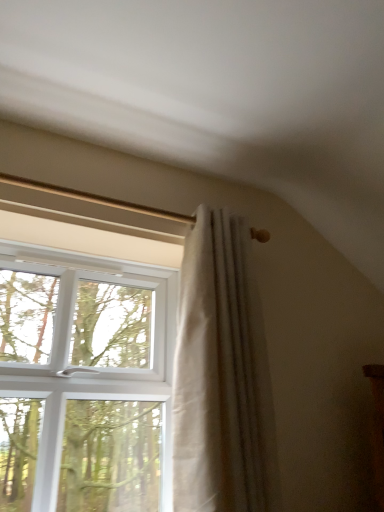
This screenshot has height=512, width=384. Find the location of `white textured curtain at center`. white textured curtain at center is located at coordinates (221, 377).

What do you see at coordinates (221, 377) in the screenshot? I see `white textured curtain at center` at bounding box center [221, 377].

The width and height of the screenshot is (384, 512). Describe the element at coordinates (84, 382) in the screenshot. I see `white plastic window at upper left` at that location.

The image size is (384, 512). Find the location of `white plastic window at upper left`. white plastic window at upper left is located at coordinates (84, 382).

Image resolution: width=384 pixels, height=512 pixels. I want to click on white textured curtain at center, so click(221, 377).

Which is more to the right, white textured curtain at center or white plastic window at upper left?

white textured curtain at center.

Who is more distant, white textured curtain at center or white plastic window at upper left?

white textured curtain at center is further away from the camera.

Considering the positions of points (175, 410) and (17, 409), is point (175, 410) farther from camera compared to point (17, 409)?

No, it is not.

From the image's perspective, which one is positioned lower, white textured curtain at center or white plastic window at upper left?

white plastic window at upper left.

In the scene shown: From a real-world perspective, is white textured curtain at center physically below white plastic window at upper left?

No, from a real-world perspective, white textured curtain at center is not beneath white plastic window at upper left.

Looking at their sizes, would you say white textured curtain at center is wider or thinner than white plastic window at upper left?

In the image, white textured curtain at center appears to be more narrow than white plastic window at upper left.

Who is taller, white textured curtain at center or white plastic window at upper left?

Standing taller between the two is white textured curtain at center.

Considering the relative sizes of white textured curtain at center and white plastic window at upper left in the image provided, is white textured curtain at center bigger than white plastic window at upper left?

No, white textured curtain at center is not bigger than white plastic window at upper left.

Would you say white textured curtain at center contains white plastic window at upper left?

That's incorrect, white plastic window at upper left is not inside white textured curtain at center.

Would you consider white textured curtain at center to be distant from white plastic window at upper left?

They are positioned close to each other.

Could you tell me if white textured curtain at center is turned towards white plastic window at upper left?

No, white textured curtain at center is not facing towards white plastic window at upper left.

How different are the orientations of white textured curtain at center and white plastic window at upper left in degrees?

The facing directions of white textured curtain at center and white plastic window at upper left are 0.0031 degrees apart.

How far apart are white textured curtain at center and white plastic window at upper left?

white textured curtain at center is 17.33 inches away from white plastic window at upper left.

The width and height of the screenshot is (384, 512). I want to click on window in front of the white textured curtain at center, so click(x=84, y=382).

Is white plastic window at upper left to the left of white textured curtain at center from the viewer's perspective?

Yes.

Between white plastic window at upper left and white textured curtain at center, which one is positioned behind?

white textured curtain at center is more distant.

Which is in front, point (91, 454) or point (245, 346)?

The point (245, 346) is more forward.

From the image's perspective, between white plastic window at upper left and white textured curtain at center, which one is located above?

From the image's view, white textured curtain at center is above.

From a real-world perspective, does white plastic window at upper left stand above white textured curtain at center?

Actually, white plastic window at upper left is physically below white textured curtain at center in the real world.

Considering the sizes of objects white plastic window at upper left and white textured curtain at center in the image provided, who is thinner, white plastic window at upper left or white textured curtain at center?

white textured curtain at center is thinner.

Considering the sizes of objects white plastic window at upper left and white textured curtain at center in the image provided, who is taller, white plastic window at upper left or white textured curtain at center?

With more height is white textured curtain at center.

Which of these two, white plastic window at upper left or white textured curtain at center, is smaller?

Smaller between the two is white textured curtain at center.

Would you say white plastic window at upper left is inside or outside white textured curtain at center?

white plastic window at upper left lies outside white textured curtain at center.

Is white plastic window at upper left directly adjacent to white textured curtain at center?

No, white plastic window at upper left is not touching white textured curtain at center.

Is white plastic window at upper left turned away from white textured curtain at center?

No.

What's the angular difference between white plastic window at upper left and white textured curtain at center's facing directions?

0.0031 degrees.

Locate an element on the screen. window below the white textured curtain at center (from a real-world perspective) is located at coordinates (84, 382).

You are a GUI agent. You are given a task and a screenshot of the screen. Output one action in this format:
    pyautogui.click(x=<x>, y=<y>)
    Task: Click on the window lying in front of the white textured curtain at center
    
    Given the screenshot: What is the action you would take?
    pyautogui.click(x=84, y=382)

In the image, there is a white textured curtain at center. Where is `window below it (from the image's perspective)`? The image size is (384, 512). window below it (from the image's perspective) is located at coordinates (84, 382).